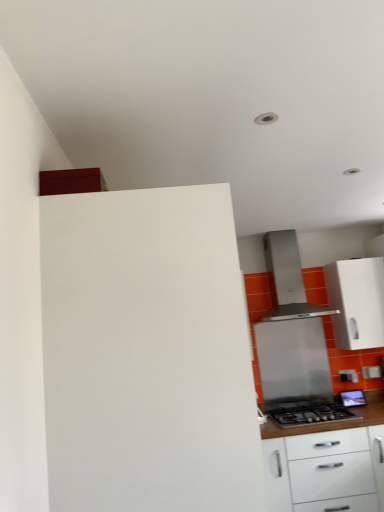
Question: From the image's perspective, would you say stainless steel gas stove at lower right is positioned over stainless steel range hood at center?

Choices:
 (A) yes
 (B) no

Answer: (B)

Question: From a real-world perspective, is stainless steel gas stove at lower right over stainless steel range hood at center?

Choices:
 (A) no
 (B) yes

Answer: (A)

Question: Is stainless steel gas stove at lower right positioned with its back to stainless steel range hood at center?

Choices:
 (A) no
 (B) yes

Answer: (A)

Question: Is stainless steel gas stove at lower right touching stainless steel range hood at center?

Choices:
 (A) no
 (B) yes

Answer: (A)

Question: Does stainless steel gas stove at lower right come in front of stainless steel range hood at center?

Choices:
 (A) no
 (B) yes

Answer: (B)

Question: Does stainless steel gas stove at lower right have a greater height compared to stainless steel range hood at center?

Choices:
 (A) yes
 (B) no

Answer: (B)

Question: Can you confirm if stainless steel range hood at center is bigger than white glossy cabinet at lower right, the second cabinetry when ordered from back to front?

Choices:
 (A) no
 (B) yes

Answer: (A)

Question: Is stainless steel range hood at center oriented towards white glossy cabinet at lower right, the second cabinetry when ordered from back to front?

Choices:
 (A) yes
 (B) no

Answer: (B)

Question: Can you confirm if stainless steel range hood at center is shorter than white glossy cabinet at lower right, the second cabinetry when ordered from back to front?

Choices:
 (A) yes
 (B) no

Answer: (A)

Question: Is stainless steel range hood at center surrounding white glossy cabinet at lower right, which appears as the 2th cabinetry when viewed from the front?

Choices:
 (A) yes
 (B) no

Answer: (B)

Question: Is stainless steel range hood at center positioned beyond the bounds of white glossy cabinet at lower right, which is the 2th cabinetry in right-to-left order?

Choices:
 (A) no
 (B) yes

Answer: (B)

Question: Is there a large distance between stainless steel range hood at center and white glossy cabinet at lower right, which is the 2th cabinetry in right-to-left order?

Choices:
 (A) no
 (B) yes

Answer: (A)

Question: From the image's perspective, is white glossy cabinet at lower right, which appears as the 2th cabinetry when viewed from the left, above white glossy cabinet at right, acting as the first cabinetry starting from the right?

Choices:
 (A) yes
 (B) no

Answer: (B)